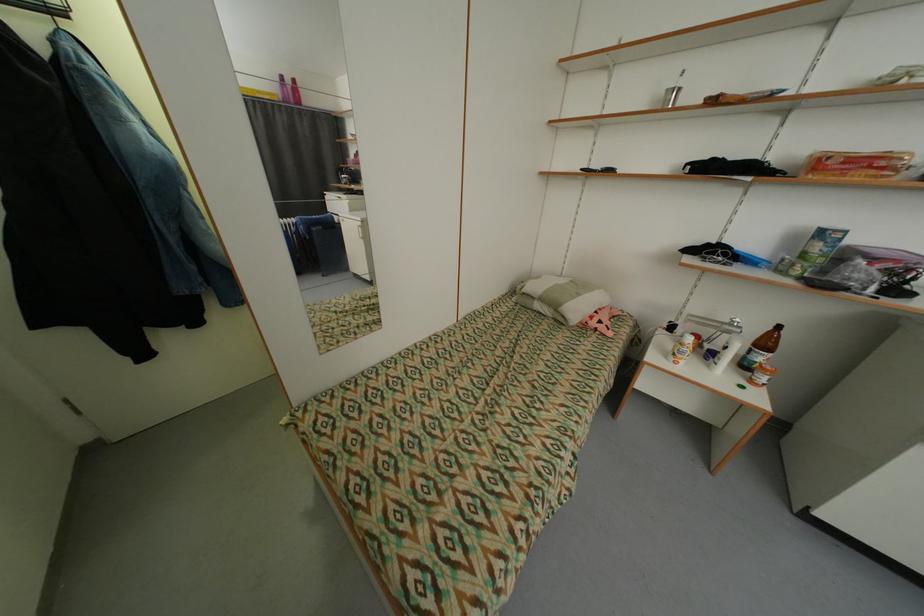
The width and height of the screenshot is (924, 616). What are the coordinates of `white plastic bottle` in the screenshot? It's located at (724, 354).